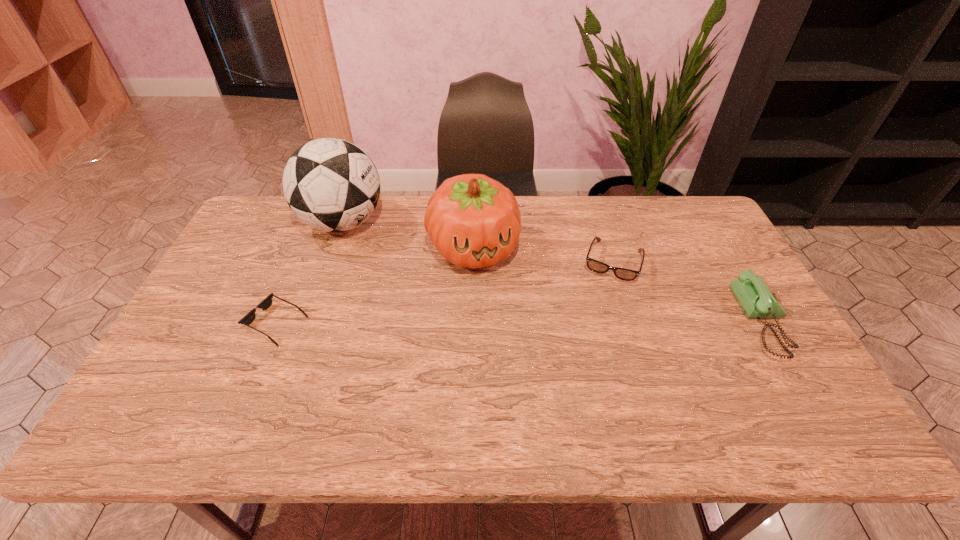
This screenshot has height=540, width=960. Identify the location of free spot on the desktop that is between the sunglasses and the telephone and is positioned on the lenses of the fourth object from left to right. (593, 322).

Find the location of a particular element. This screenshot has width=960, height=540. free space on the desktop that is between the shortest object and the rightmost object and is positioned on the side of the pumpkin with the cute face is located at coordinates (500, 322).

Find the location of a particular element. The width and height of the screenshot is (960, 540). vacant space on the desktop that is between the shortest object and the rightmost object and is positioned on the surface of the soccer ball where the brand logo is visible is located at coordinates (459, 322).